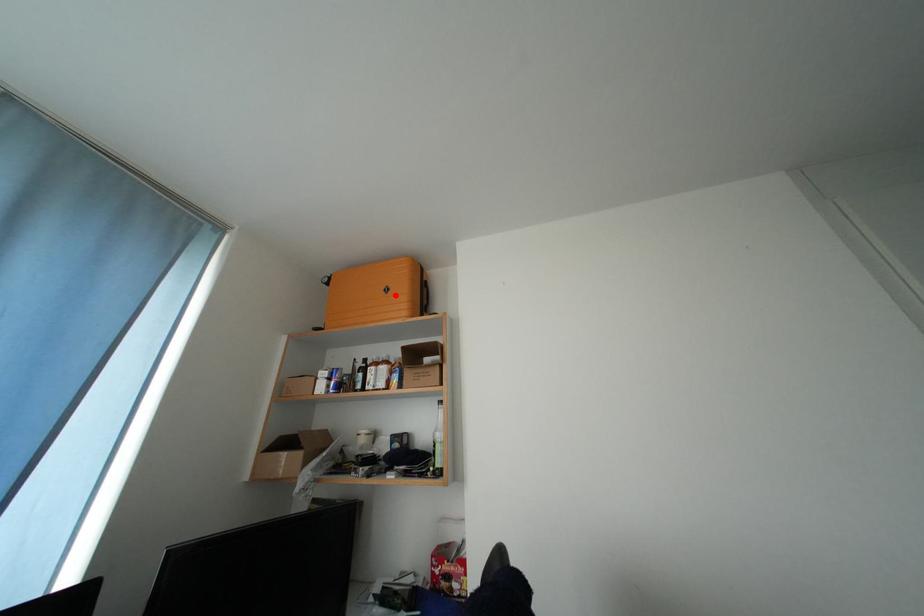
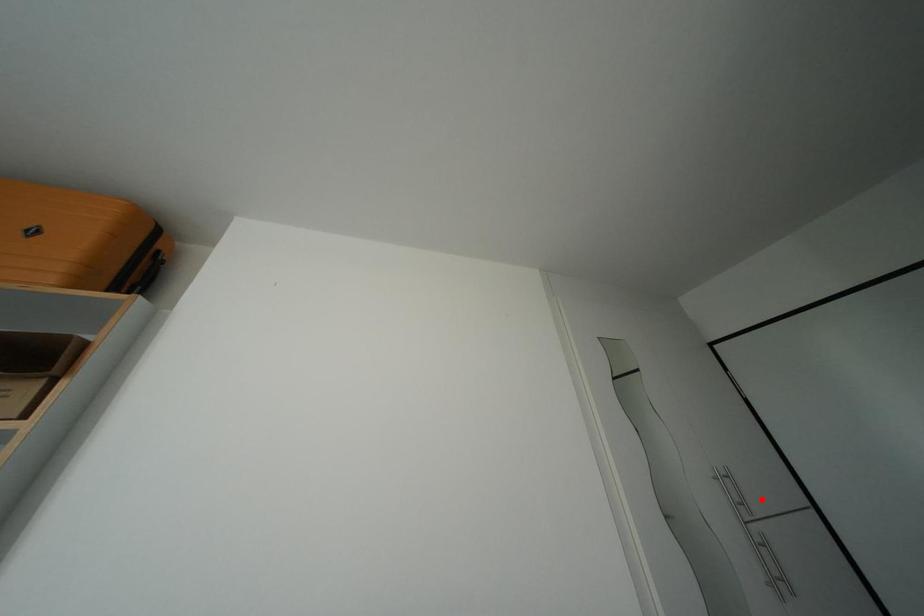
I am providing you with two images of the same scene from different viewpoints. A red point is marked on the first image and another point is marked on the second image. Are the points marked in image1 and image2 representing the same 3D position?

No